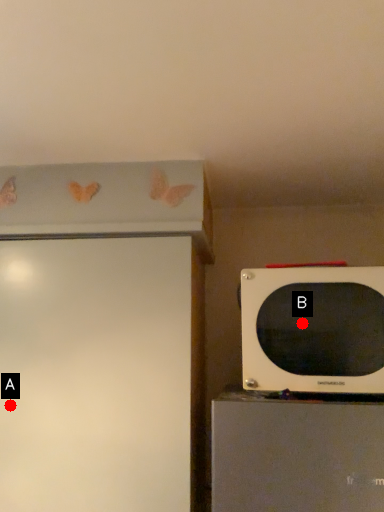
Question: Two points are circled on the image, labeled by A and B beside each circle. Which point is closer to the camera taking this photo?

Choices:
 (A) A is closer
 (B) B is closer

Answer: (B)